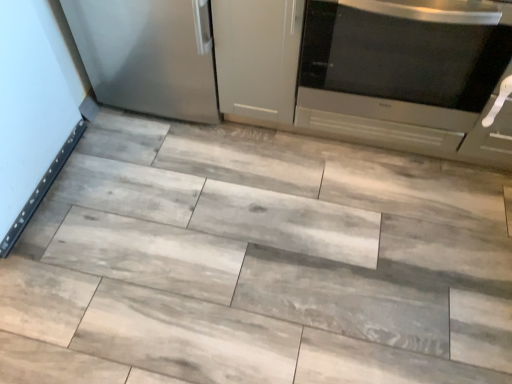
Question: Is satin metallic refrigerator at left situated inside satin silver microwave at right or outside?

Choices:
 (A) outside
 (B) inside

Answer: (A)

Question: From the image's perspective, is satin metallic refrigerator at left positioned above or below satin silver microwave at right?

Choices:
 (A) above
 (B) below

Answer: (A)

Question: Estimate the real-world distances between objects in this image. Which object is farther from the satin metallic refrigerator at left?

Choices:
 (A) gray wood tile at center
 (B) satin silver microwave at right

Answer: (B)

Question: Which object is positioned farthest from the satin metallic refrigerator at left?

Choices:
 (A) gray wood tile at center
 (B) satin silver microwave at right

Answer: (B)